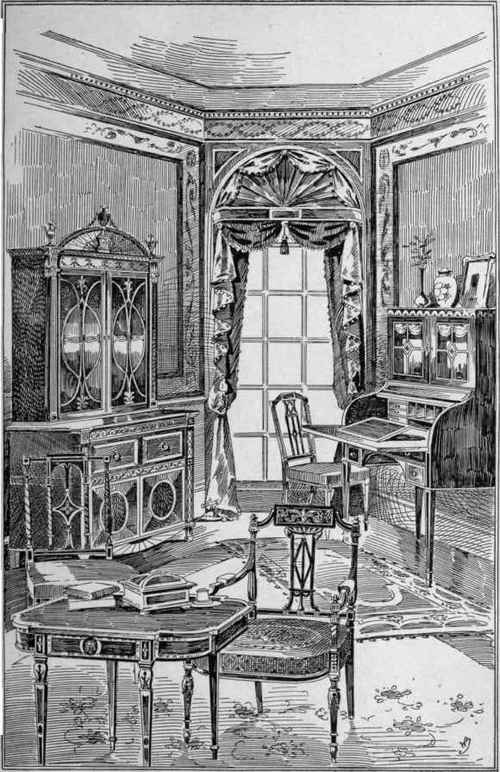
This screenshot has width=500, height=772. I want to click on books, so click(97, 598).